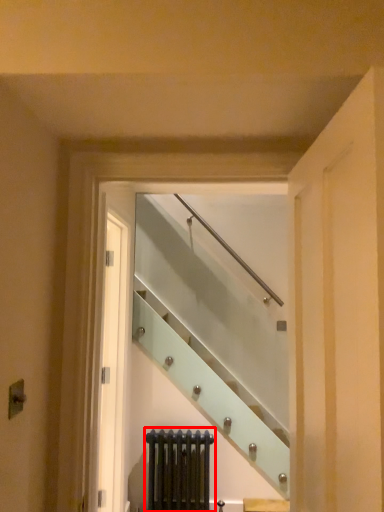
Question: In this image, where is radiator (annotated by the red box) located relative to escalator?

Choices:
 (A) left
 (B) right

Answer: (A)